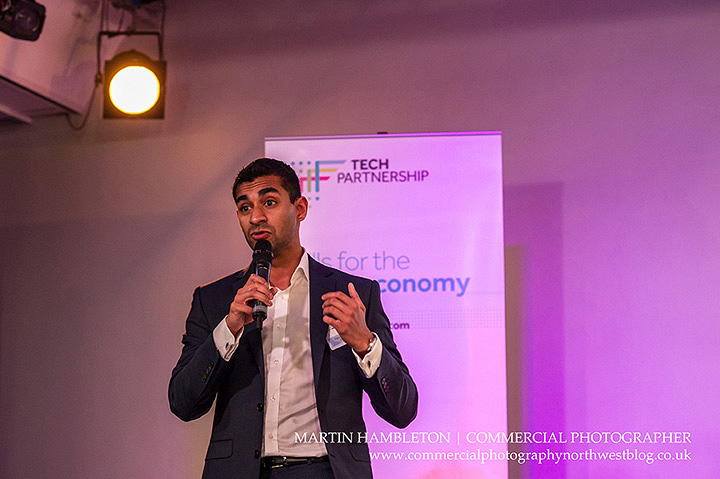
Where is `white protruding wall`? This screenshot has width=720, height=479. white protruding wall is located at coordinates (48, 84).